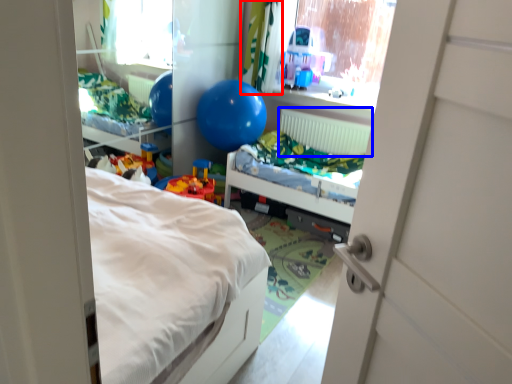
Question: Which point is further to the camera, curtain (highlighted by a red box) or radiator (highlighted by a blue box)?

Choices:
 (A) curtain
 (B) radiator

Answer: (B)